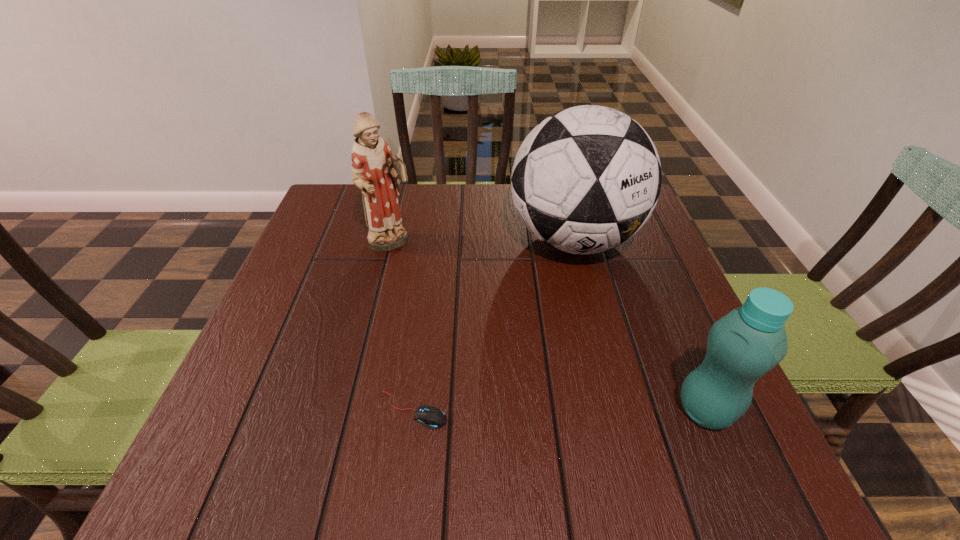
Where is `object at the near right corner`? The image size is (960, 540). object at the near right corner is located at coordinates (748, 342).

In the image, there is a desktop. Identify the location of vacant space at the far edge. (482, 224).

The image size is (960, 540). I want to click on free space at the near edge, so click(x=511, y=417).

Locate an element on the screen. This screenshot has width=960, height=540. blank space at the left edge is located at coordinates (257, 378).

I want to click on free region at the right edge of the desktop, so click(620, 252).

You are a GUI agent. You are given a task and a screenshot of the screen. Output one action in this format:
    pyautogui.click(x=<x>, y=<y>)
    Task: Click on the vacant area at the far left corner
    
    Given the screenshot: What is the action you would take?
    coord(333,207)

Identify the location of blank region between the shortest object and the figurine. (402, 327).

At what (x,y) coordinates should I click in order to perform the action: click on unoccupied position between the figurine and the soccer ball. Please return your answer as a coordinate pair (x, y). Looking at the image, I should click on (483, 242).

In order to click on vacant space that's between the figurine and the soccer ball in this screenshot , I will do tap(483, 242).

The width and height of the screenshot is (960, 540). Find the location of `blank region between the mouse and the second shortest object`. blank region between the mouse and the second shortest object is located at coordinates (560, 410).